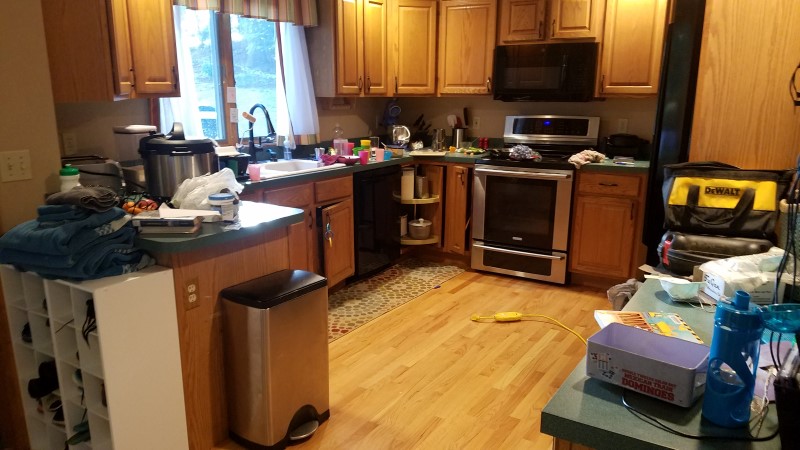
You are a GUI agent. You are given a task and a screenshot of the screen. Output one action in this format:
    pyautogui.click(x=<x>, y=<y>)
    Task: Click on the area rug
    
    Given the screenshot: What is the action you would take?
    [x=382, y=290]